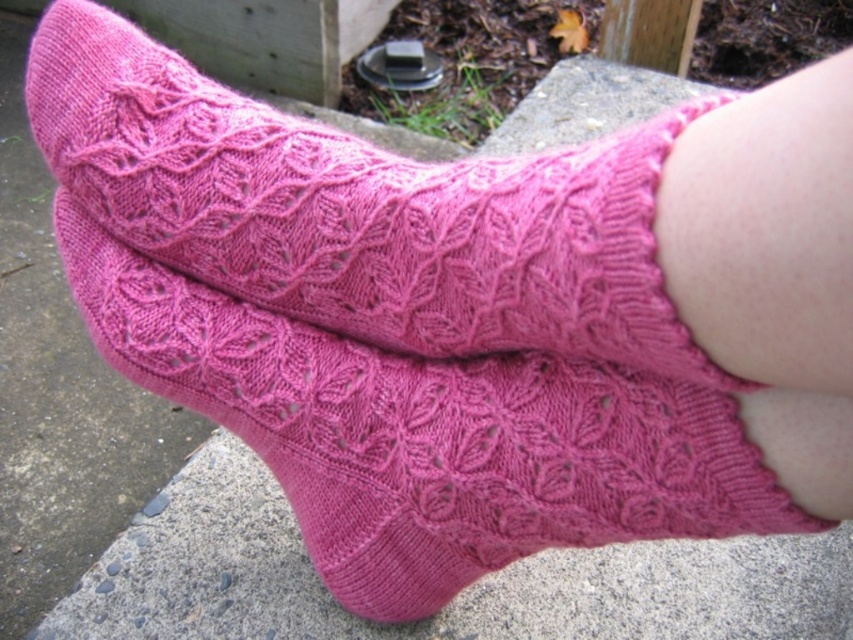
Based on the photo, does pink knitted socks at center have a lesser width compared to matte pink socks at center?

No, pink knitted socks at center is not thinner than matte pink socks at center.

Who is lower down, pink knitted socks at center or matte pink socks at center?

pink knitted socks at center is below.

Who is more distant from viewer, (515, 464) or (561, 262)?

The point (515, 464) is more distant.

At what (x,y) coordinates should I click in order to perform the action: click on pink knitted socks at center. Please return your answer as a coordinate pair (x, y). This screenshot has width=853, height=640. Looking at the image, I should click on (428, 376).